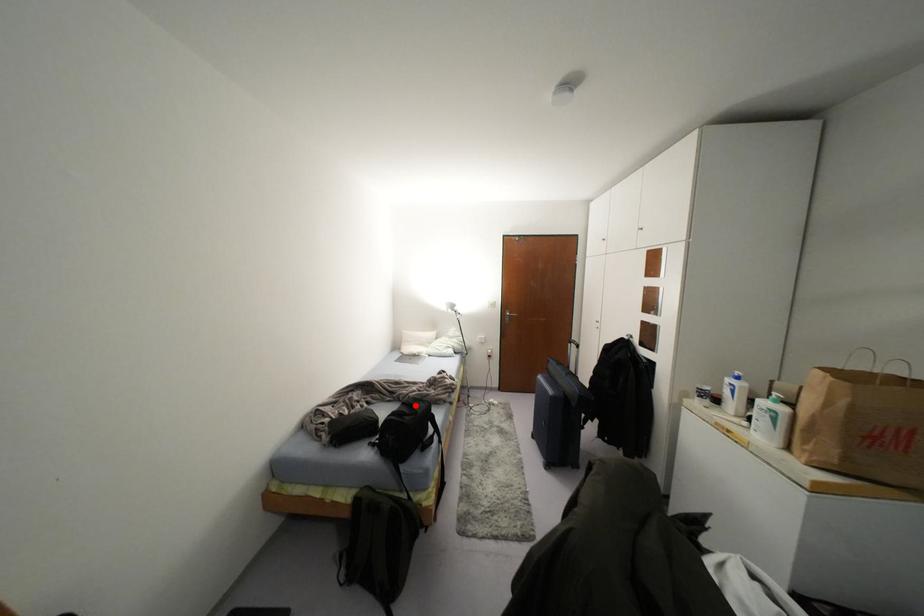
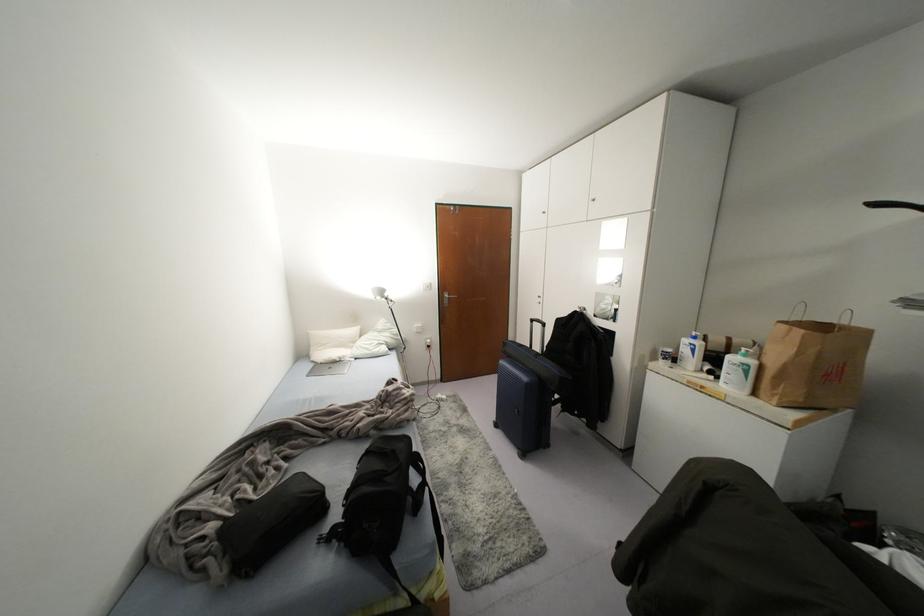
Where in the second image is the point corresponding to the highlighted location from the first image?

(393, 451)